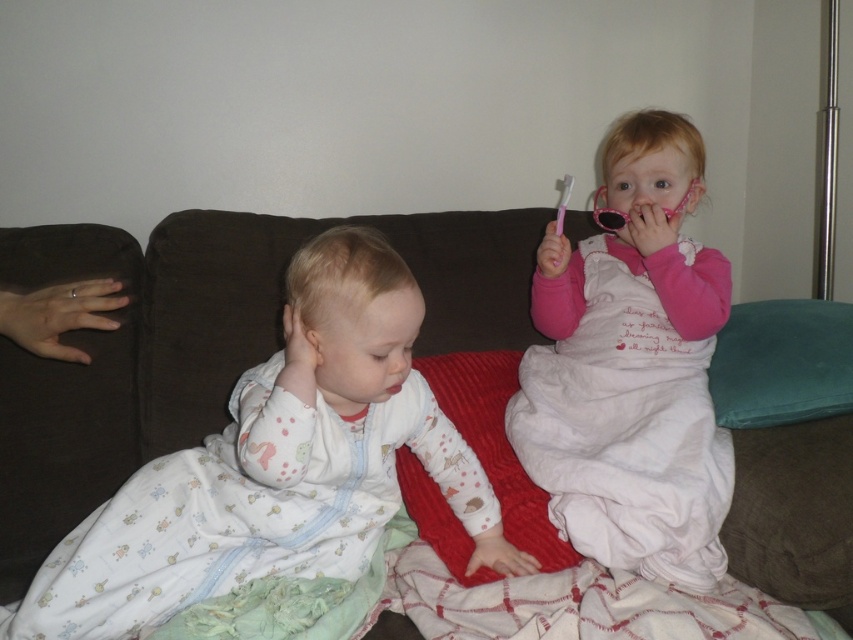
You are a photographer trying to capture a closeup of the pink plastic toothbrush at upper right without the pink satin dress at upper right blocking the view. Is this possible given their sizes?

The pink satin dress at upper right is larger in size than the pink plastic toothbrush at upper right, so it may block the toothbrush from view. Adjust your angle to ensure the smaller toothbrush is visible beyond or around the dress.

You are a photographer taking a picture of the two children on the couch. You need to ensure that both the pink satin dress at upper right and the pink plastic toothbrush at upper right are clearly visible in the frame. Given their relative sizes, which object might require you to adjust your camera angle to avoid being overshadowed?

The pink plastic toothbrush at upper right might require adjusting the camera angle since the pink satin dress at upper right is taller and could potentially block or overshadow it in the photo.

You are a photographer trying to capture the child on the right. You notice a point at coordinates (631, 369) in the image. Based on the scene description, where is this point located relative to the pink satin dress at upper right?

The point at coordinates (631, 369) is located on the pink satin dress at upper right.